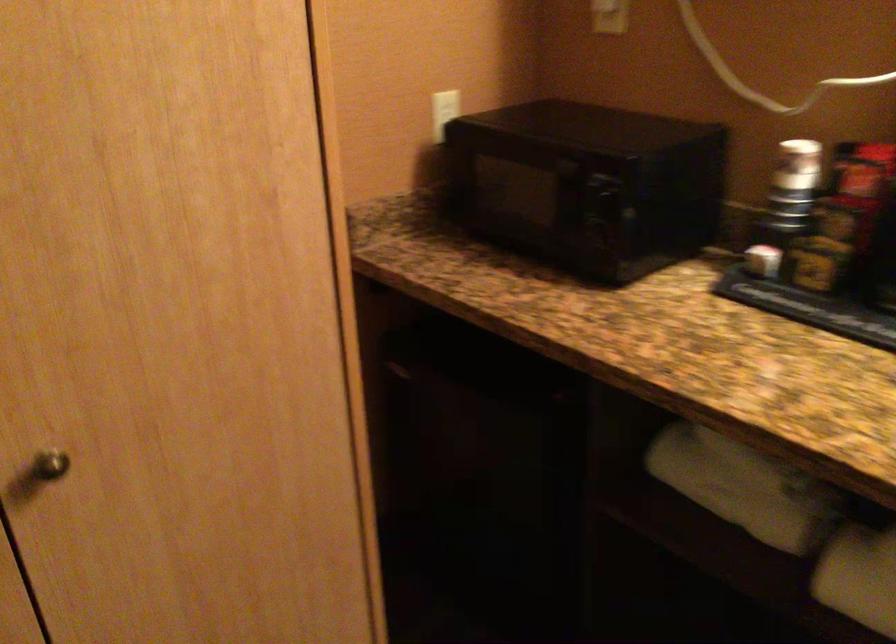
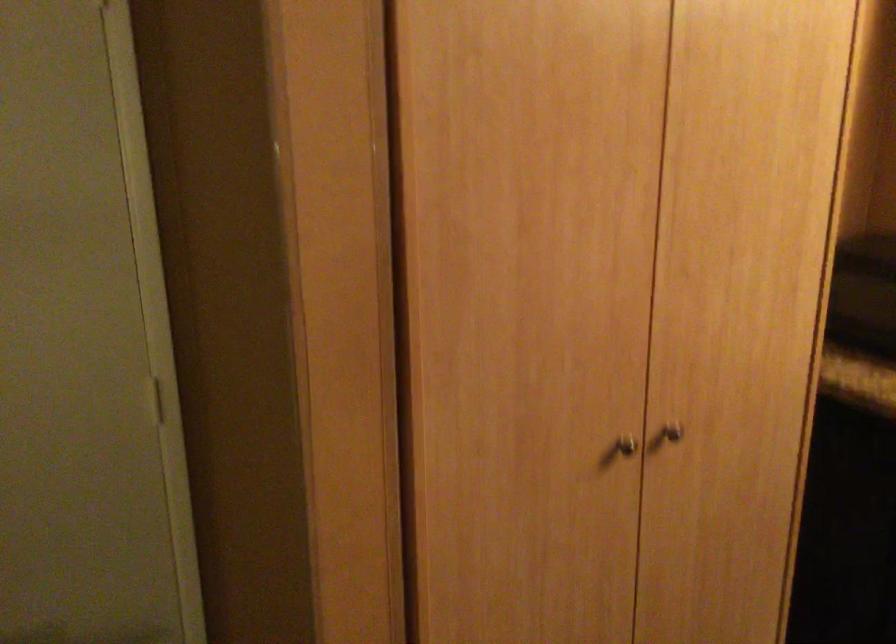
The point at (89, 444) is marked in the first image. Where is the corresponding point in the second image?

(673, 431)